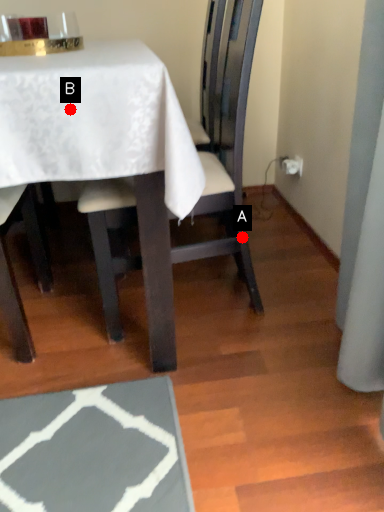
Question: Two points are circled on the image, labeled by A and B beside each circle. Which of the following is the closest to the observer?

Choices:
 (A) A is closer
 (B) B is closer

Answer: (B)